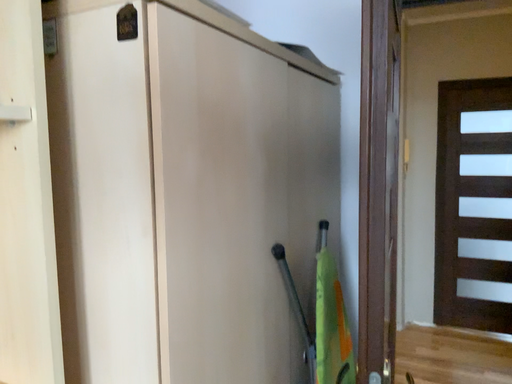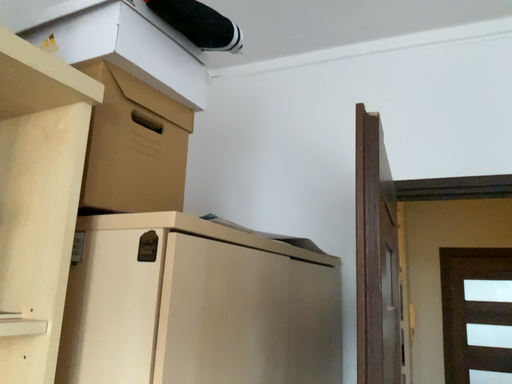
Question: Which way did the camera rotate in the video?

Choices:
 (A) rotated upward
 (B) rotated downward

Answer: (A)